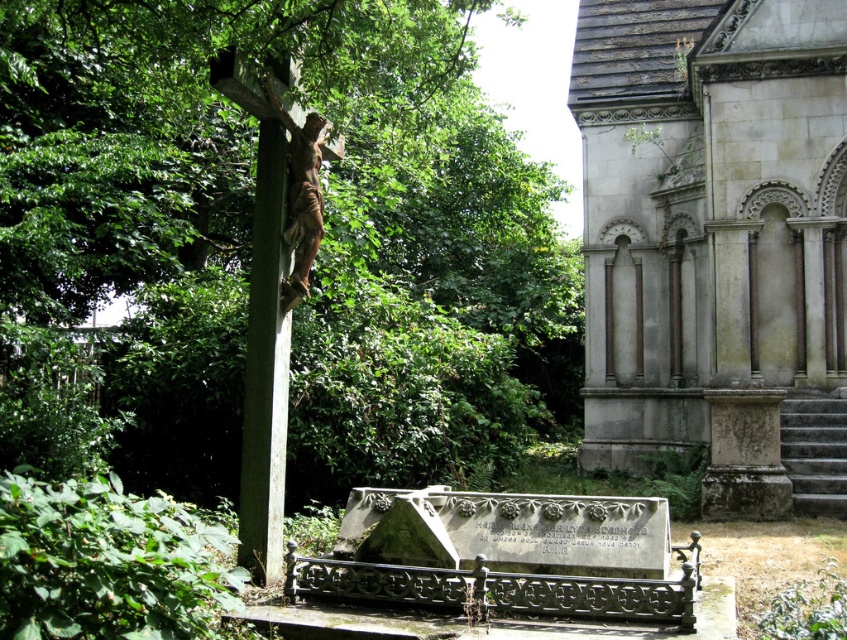
You are a tourist visiting the cemetery and want to take a photo that includes both the gray stone church at right and the green stone cross at left. Based on their sizes, which object should you position closer to the center of the frame to ensure both are visible without cropping?

Since the gray stone church at right is larger in size than the green stone cross at left, you should position the gray stone church at right closer to the center of the frame to ensure both are visible without cropping.

You are standing in front of the crucifix in the cemetery scene. You notice two points marked in the image at coordinates point [385,170] and point [295,128]. Which point is closer to you?

Point [295,128] is closer to you because it is less far from the camera compared to point [385,170].

You are a visitor at the cemetery and want to take a photo of the bronze statue at center without the green leafy tree at left appearing in the background. Is this possible given their positions?

The green leafy tree at left is located above the bronze statue at center, so if you position yourself to frame the bronze statue at center from a lower angle, the tree might still appear in the upper part of the photo. However, if you move closer to the statue and use a wider angle lens, you could potentially exclude the tree from the frame depending on its actual distance and height.